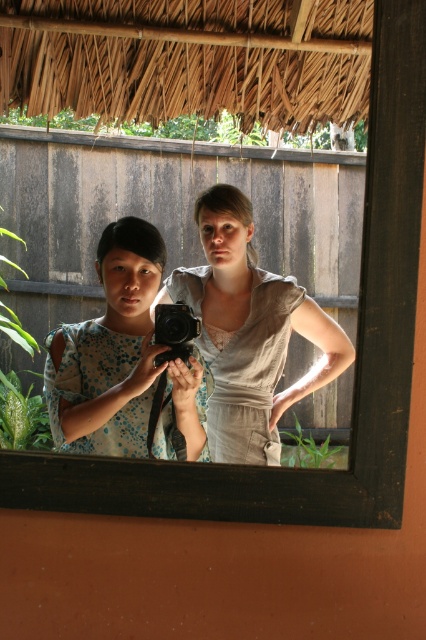
Is blue dotted fabric dress at left shorter than black plastic camera at center?

In fact, blue dotted fabric dress at left may be taller than black plastic camera at center.

Who is positioned more to the left, blue dotted fabric dress at left or black plastic camera at center?

blue dotted fabric dress at left is more to the left.

Which is in front, point (126, 342) or point (181, 314)?

Point (181, 314) is more forward.

Where is `blue dotted fabric dress at left`? This screenshot has width=426, height=640. blue dotted fabric dress at left is located at coordinates (120, 356).

Is point (267, 413) positioned in front of point (57, 349)?

No, it is behind (57, 349).

In the scene shown: Between light beige fabric dress at center and blue dotted fabric dress at left, which one is positioned higher?

light beige fabric dress at center is higher up.

At what (x,y) coordinates should I click in order to perform the action: click on light beige fabric dress at center. Please return your answer as a coordinate pair (x, y). The height and width of the screenshot is (640, 426). Looking at the image, I should click on (249, 332).

Is light beige fabric dress at center below black plastic camera at center?

Incorrect, light beige fabric dress at center is not positioned below black plastic camera at center.

Which is behind, point (331, 371) or point (193, 337)?

The point (331, 371) is behind.

Image resolution: width=426 pixels, height=640 pixels. What are the coordinates of `light beige fabric dress at center` in the screenshot? It's located at (249, 332).